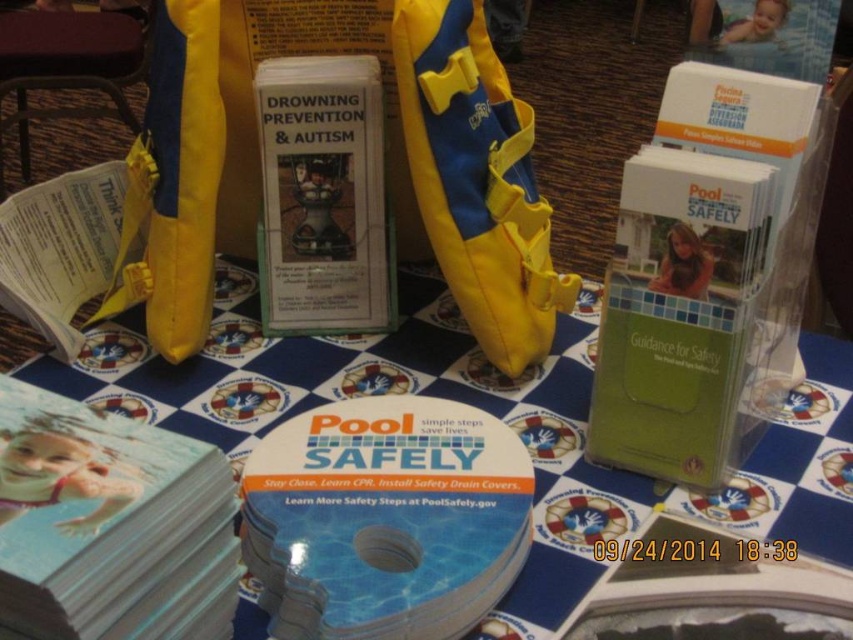
Measure the distance from blue printed paper at center to matte plastic toy at center.

6.65 inches

Which is more to the left, blue printed paper at center or matte plastic toy at center?

matte plastic toy at center is more to the left.

Who is more distant from viewer, (759, 509) or (332, 253)?

The point (332, 253) is behind.

Image resolution: width=853 pixels, height=640 pixels. What are the coordinates of `blue printed paper at center` in the screenshot? It's located at (491, 413).

Is yellow fabric life vest at center wider than matte white brochure at center?

Yes, yellow fabric life vest at center is wider than matte white brochure at center.

Between yellow fabric life vest at center and matte white brochure at center, which one has less height?

matte white brochure at center is shorter.

Where is `yellow fabric life vest at center`? Image resolution: width=853 pixels, height=640 pixels. yellow fabric life vest at center is located at coordinates (477, 179).

Can you confirm if white paper book at center is positioned to the right of yellow fabric life vest at center?

Incorrect, white paper book at center is not on the right side of yellow fabric life vest at center.

Who is positioned more to the left, white paper book at center or yellow fabric life vest at center?

Positioned to the left is white paper book at center.

You are a GUI agent. You are given a task and a screenshot of the screen. Output one action in this format:
    pyautogui.click(x=<x>, y=<y>)
    Task: Click on the white paper book at center
    This screenshot has width=853, height=640.
    Given the screenshot: What is the action you would take?
    pyautogui.click(x=109, y=524)